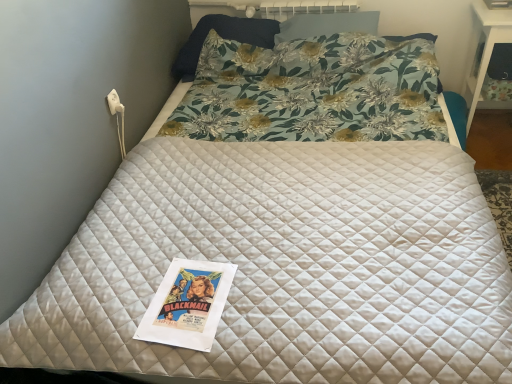
The width and height of the screenshot is (512, 384). What do you see at coordinates (223, 38) in the screenshot? I see `floral fabric pillow at upper center, positioned as the second pillow in right-to-left order` at bounding box center [223, 38].

The height and width of the screenshot is (384, 512). I want to click on floral fabric pillow at upper center, which is the 1th pillow in right-to-left order, so click(x=327, y=25).

The image size is (512, 384). In order to click on white glossy table at upper right in this screenshot , I will do `click(484, 50)`.

You are a GUI agent. You are given a task and a screenshot of the screen. Output one action in this format:
    pyautogui.click(x=<x>, y=<y>)
    Task: Click on the floral fabric pillow at upper center, positioned as the second pillow in right-to-left order
    The width and height of the screenshot is (512, 384).
    Given the screenshot: What is the action you would take?
    pyautogui.click(x=223, y=38)

Does floral fabric pillow at upper center, which is the 1th pillow in right-to-left order, lie in front of floral fabric pillow at upper center, positioned as the second pillow in right-to-left order?

Yes, it is in front of floral fabric pillow at upper center, positioned as the second pillow in right-to-left order.

At what (x,y) coordinates should I click in order to perform the action: click on pillow located on the left of floral fabric pillow at upper center, which appears as the second pillow when viewed from the left. Please return your answer as a coordinate pair (x, y). The image size is (512, 384). Looking at the image, I should click on (223, 38).

This screenshot has width=512, height=384. I want to click on pillow on the left of floral fabric pillow at upper center, which appears as the second pillow when viewed from the left, so click(223, 38).

From the picture: Which is farther, (239, 37) or (309, 34)?

The point (239, 37) is farther from the camera.

From the image's perspective, is floral fabric pillow at upper center, positioned as the second pillow in right-to-left order, over floral fabric pillow at upper center, which appears as the second pillow when viewed from the left?

No, from the image's perspective, floral fabric pillow at upper center, positioned as the second pillow in right-to-left order, is not above floral fabric pillow at upper center, which appears as the second pillow when viewed from the left.

Is floral fabric pillow at upper center, which appears as the second pillow when viewed from the left, facing towards white glossy table at upper right?

No, floral fabric pillow at upper center, which appears as the second pillow when viewed from the left, is not aimed at white glossy table at upper right.

Starting from the white glossy table at upper right, which pillow is the 1st one behind? Please provide its 2D coordinates.

[(327, 25)]

Is floral fabric pillow at upper center, which appears as the second pillow when viewed from the left, shorter than white glossy table at upper right?

Yes.

Considering the positions of objects floral fabric pillow at upper center, which is the 1th pillow in right-to-left order, and white glossy table at upper right in the image provided, who is more to the left, floral fabric pillow at upper center, which is the 1th pillow in right-to-left order, or white glossy table at upper right?

From the viewer's perspective, floral fabric pillow at upper center, which is the 1th pillow in right-to-left order, appears more on the left side.

Where is `table in front of the floral fabric pillow at upper center, the first pillow positioned from the left`? The width and height of the screenshot is (512, 384). table in front of the floral fabric pillow at upper center, the first pillow positioned from the left is located at coordinates (484, 50).

Considering the positions of point (246, 28) and point (469, 57), is point (246, 28) closer or farther from the camera than point (469, 57)?

Point (246, 28) appears to be closer to the viewer than point (469, 57).

Does floral fabric pillow at upper center, positioned as the second pillow in right-to-left order, have a greater width compared to white glossy table at upper right?

Yes.

Is floral fabric pillow at upper center, the first pillow positioned from the left, positioned far away from white glossy table at upper right?

That's right, there is a large distance between floral fabric pillow at upper center, the first pillow positioned from the left, and white glossy table at upper right.

Does white glossy table at upper right touch floral fabric pillow at upper center, which is the 1th pillow in right-to-left order?

No, white glossy table at upper right is not next to floral fabric pillow at upper center, which is the 1th pillow in right-to-left order.

From the image's perspective, is white glossy table at upper right on top of floral fabric pillow at upper center, which appears as the second pillow when viewed from the left?

Incorrect, from the image's perspective, white glossy table at upper right is lower than floral fabric pillow at upper center, which appears as the second pillow when viewed from the left.

Is the depth of white glossy table at upper right greater than that of floral fabric pillow at upper center, positioned as the second pillow in right-to-left order?

No, it is not.

Considering the sizes of objects white glossy table at upper right and floral fabric pillow at upper center, positioned as the second pillow in right-to-left order, in the image provided, who is smaller, white glossy table at upper right or floral fabric pillow at upper center, positioned as the second pillow in right-to-left order,?

With smaller size is floral fabric pillow at upper center, positioned as the second pillow in right-to-left order.

Can you see white glossy table at upper right touching floral fabric pillow at upper center, the first pillow positioned from the left?

No, white glossy table at upper right is not beside floral fabric pillow at upper center, the first pillow positioned from the left.

This screenshot has width=512, height=384. Find the location of `pillow on the left of floral fabric pillow at upper center, which is the 1th pillow in right-to-left order`. pillow on the left of floral fabric pillow at upper center, which is the 1th pillow in right-to-left order is located at coordinates (223, 38).

Find the location of `pillow directly beneath the floral fabric pillow at upper center, which appears as the second pillow when viewed from the left (from a real-world perspective)`. pillow directly beneath the floral fabric pillow at upper center, which appears as the second pillow when viewed from the left (from a real-world perspective) is located at coordinates (223, 38).

Looking at the image, which one is located further to floral fabric pillow at upper center, the first pillow positioned from the left, floral fabric pillow at upper center, which appears as the second pillow when viewed from the left, or white glossy table at upper right?

The object further to floral fabric pillow at upper center, the first pillow positioned from the left, is white glossy table at upper right.

When comparing their distances from white glossy table at upper right, does floral fabric pillow at upper center, positioned as the second pillow in right-to-left order, or floral fabric pillow at upper center, which appears as the second pillow when viewed from the left, seem further?

floral fabric pillow at upper center, positioned as the second pillow in right-to-left order.

When comparing their distances from floral fabric pillow at upper center, which is the 1th pillow in right-to-left order, does floral fabric pillow at upper center, the first pillow positioned from the left, or white glossy table at upper right seem further?

Among the two, white glossy table at upper right is located further to floral fabric pillow at upper center, which is the 1th pillow in right-to-left order.

Considering their positions, is floral fabric pillow at upper center, which appears as the second pillow when viewed from the left, positioned further to white glossy table at upper right than floral fabric pillow at upper center, positioned as the second pillow in right-to-left order?

The object further to white glossy table at upper right is floral fabric pillow at upper center, positioned as the second pillow in right-to-left order.

Based on their spatial positions, is white glossy table at upper right or floral fabric pillow at upper center, positioned as the second pillow in right-to-left order, further from floral fabric pillow at upper center, which appears as the second pillow when viewed from the left?

Among the two, white glossy table at upper right is located further to floral fabric pillow at upper center, which appears as the second pillow when viewed from the left.

Based on their spatial positions, is white glossy table at upper right or floral fabric pillow at upper center, which is the 1th pillow in right-to-left order, further from floral fabric pillow at upper center, positioned as the second pillow in right-to-left order?

Based on the image, white glossy table at upper right appears to be further to floral fabric pillow at upper center, positioned as the second pillow in right-to-left order.

You are a GUI agent. You are given a task and a screenshot of the screen. Output one action in this format:
    pyautogui.click(x=<x>, y=<y>)
    Task: Click on the pillow between floral fabric pillow at upper center, positioned as the second pillow in right-to-left order, and white glossy table at upper right, in the horizontal direction
    The image size is (512, 384).
    Given the screenshot: What is the action you would take?
    pyautogui.click(x=327, y=25)